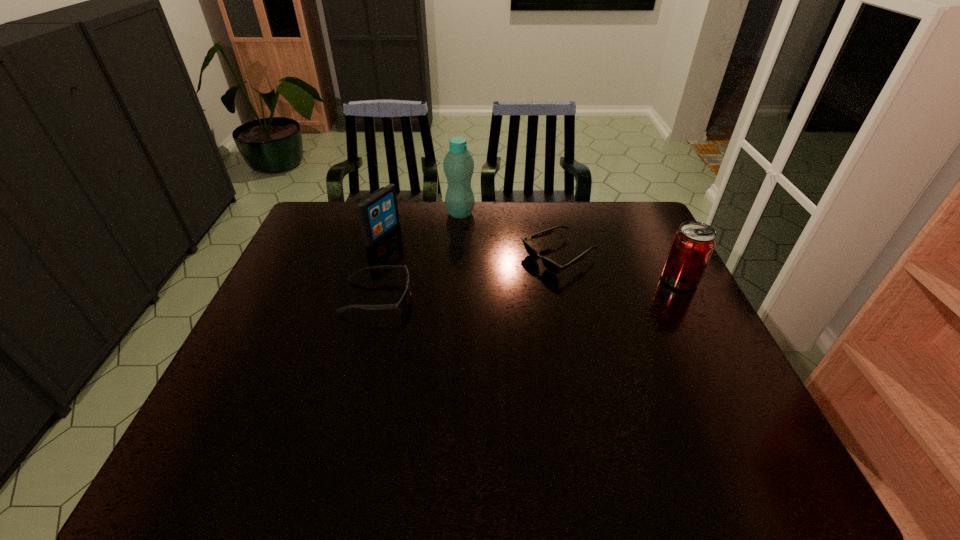
Locate an element on the screen. object that is at the right edge is located at coordinates (692, 246).

You are a GUI agent. You are given a task and a screenshot of the screen. Output one action in this format:
    pyautogui.click(x=<x>, y=<y>)
    Task: Click on the vacant region at the far edge of the desktop
    
    Given the screenshot: What is the action you would take?
    pyautogui.click(x=598, y=240)

Where is `vacant space at the near edge of the desktop`? This screenshot has width=960, height=540. vacant space at the near edge of the desktop is located at coordinates (457, 420).

The width and height of the screenshot is (960, 540). In the image, there is a desktop. What are the coordinates of `vacant space at the left edge` in the screenshot? It's located at tap(316, 241).

In the image, there is a desktop. Where is `free space at the right edge`? The image size is (960, 540). free space at the right edge is located at coordinates (667, 336).

At what (x,y) coordinates should I click in order to perform the action: click on free spot at the far right corner of the desktop. Please return your answer as a coordinate pair (x, y). Image resolution: width=960 pixels, height=540 pixels. Looking at the image, I should click on (613, 215).

Identify the location of free spot at the near right corner of the desktop. Image resolution: width=960 pixels, height=540 pixels. (725, 427).

At what (x,y) coordinates should I click in order to perform the action: click on free space between the right sunglasses and the iPod. Please return your answer as a coordinate pair (x, y). Image resolution: width=960 pixels, height=540 pixels. Looking at the image, I should click on (470, 246).

Locate an element on the screen. The width and height of the screenshot is (960, 540). empty space between the third object from left to right and the left sunglasses is located at coordinates (419, 255).

I want to click on vacant region between the iPod and the rightmost object, so click(x=531, y=257).